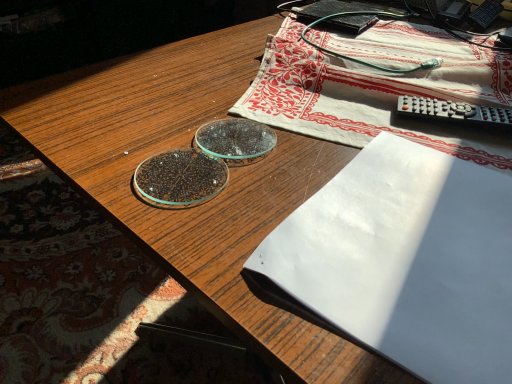
Question: Relative to white cotton tablecloth at upper center, is white paper at center in front or behind?

Choices:
 (A) behind
 (B) front

Answer: (B)

Question: Considering the positions of white paper at center and white cotton tablecloth at upper center in the image, is white paper at center bigger or smaller than white cotton tablecloth at upper center?

Choices:
 (A) small
 (B) big

Answer: (A)

Question: Estimate the real-world distances between objects in this image. Which object is farther from the black matte paperback book at upper right?

Choices:
 (A) white paper at center
 (B) white cotton tablecloth at upper center

Answer: (A)

Question: Which object is the closest to the white cotton tablecloth at upper center?

Choices:
 (A) white paper at center
 (B) black matte paperback book at upper right

Answer: (B)